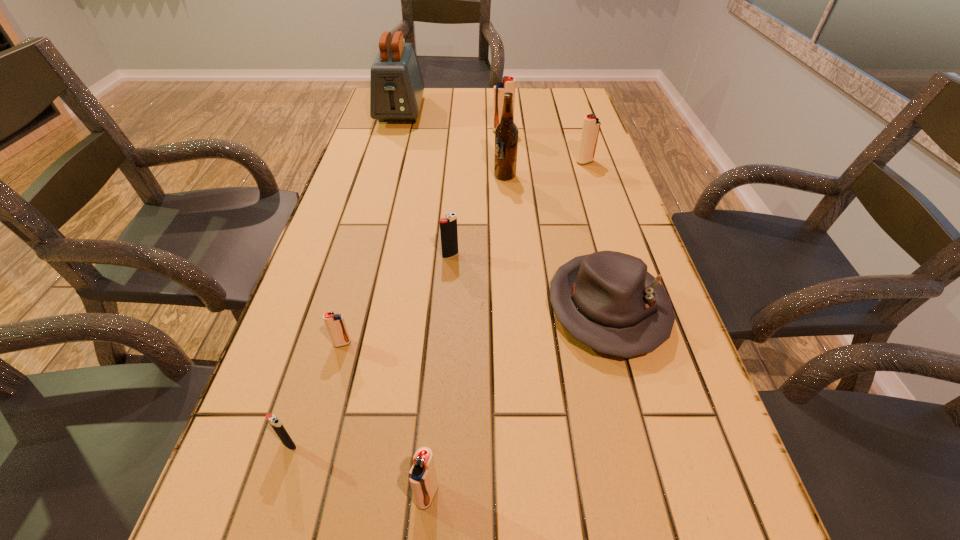
Locate an element on the screen. This screenshot has height=540, width=960. vacant space situated 0.350m on the front of the third farthest object is located at coordinates (611, 241).

Find the location of a particular element. This screenshot has width=960, height=540. free location located 0.170m on the front of the farther black igniter is located at coordinates (446, 314).

Locate an element on the screen. vacant region located on the left of the second smallest red igniter is located at coordinates (237, 495).

You are a GUI agent. You are given a task and a screenshot of the screen. Output one action in this format:
    pyautogui.click(x=<x>, y=<y>)
    Task: Click on the blank space located on the decorative side of the hat
    The height and width of the screenshot is (540, 960).
    Given the screenshot: What is the action you would take?
    pyautogui.click(x=638, y=422)

Locate an element on the screen. vacant region located 0.270m on the right of the second igniter from left to right is located at coordinates (489, 343).

Find the location of a particular element. Image resolution: width=960 pixels, height=540 pixels. vacant space located on the right of the smaller black igniter is located at coordinates (433, 444).

Image resolution: width=960 pixels, height=540 pixels. In order to click on object positioned at the far edge in this screenshot , I will do `click(396, 85)`.

This screenshot has width=960, height=540. I want to click on toaster at the left edge, so click(x=396, y=85).

You are a GUI agent. You are given a task and a screenshot of the screen. Output one action in this format:
    pyautogui.click(x=<x>, y=<y>)
    Task: Click on the igniter that is at the right edge
    The width and height of the screenshot is (960, 540).
    Given the screenshot: What is the action you would take?
    pyautogui.click(x=591, y=125)

The height and width of the screenshot is (540, 960). Identify the location of hat situated at the right edge. (607, 300).